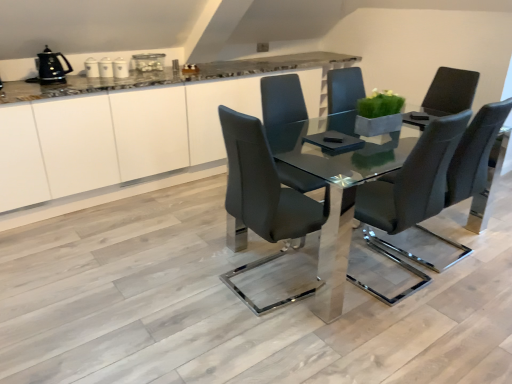
Question: From the image's perspective, is clear glass table at center located above green matte planter at center?

Choices:
 (A) no
 (B) yes

Answer: (A)

Question: Is clear glass table at center in contact with green matte planter at center?

Choices:
 (A) yes
 (B) no

Answer: (B)

Question: Considering the relative sizes of clear glass table at center and green matte planter at center in the image provided, is clear glass table at center shorter than green matte planter at center?

Choices:
 (A) no
 (B) yes

Answer: (A)

Question: From a real-world perspective, does clear glass table at center stand above green matte planter at center?

Choices:
 (A) no
 (B) yes

Answer: (A)

Question: Does clear glass table at center have a smaller size compared to green matte planter at center?

Choices:
 (A) yes
 (B) no

Answer: (B)

Question: Looking at the image, does white glossy canister at upper center, which is counted as the 3th appliance, starting from the left, seem bigger or smaller compared to green matte planter at center?

Choices:
 (A) big
 (B) small

Answer: (B)

Question: Is white glossy canister at upper center, placed as the 3th appliance when sorted from right to left, wider or thinner than green matte planter at center?

Choices:
 (A) thin
 (B) wide

Answer: (B)

Question: From a real-world perspective, relative to green matte planter at center, is white glossy canister at upper center, which is counted as the 3th appliance, starting from the left, vertically above or below?

Choices:
 (A) above
 (B) below

Answer: (A)

Question: In the image, is white glossy canister at upper center, which is counted as the 3th appliance, starting from the left, on the left side or the right side of green matte planter at center?

Choices:
 (A) left
 (B) right

Answer: (A)

Question: From a real-world perspective, is white glossy cabinetry at center physically located above or below matte black chair at center, acting as the second chair starting from the left?

Choices:
 (A) below
 (B) above

Answer: (A)

Question: Looking at the image, does white glossy cabinetry at center seem bigger or smaller compared to matte black chair at center, the first chair when ordered from right to left?

Choices:
 (A) small
 (B) big

Answer: (B)

Question: Does point (4, 205) appear closer or farther from the camera than point (366, 231)?

Choices:
 (A) farther
 (B) closer

Answer: (B)

Question: Looking at their shapes, would you say white glossy cabinetry at center is wider or thinner than matte black chair at center, the first chair when ordered from right to left?

Choices:
 (A) thin
 (B) wide

Answer: (B)

Question: Looking at the image, does matte black chair at center, which ranks as the 2th chair in right-to-left order, seem bigger or smaller compared to clear glass table at center?

Choices:
 (A) small
 (B) big

Answer: (A)

Question: Is matte black chair at center, which ranks as the 2th chair in right-to-left order, wider or thinner than clear glass table at center?

Choices:
 (A) wide
 (B) thin

Answer: (B)